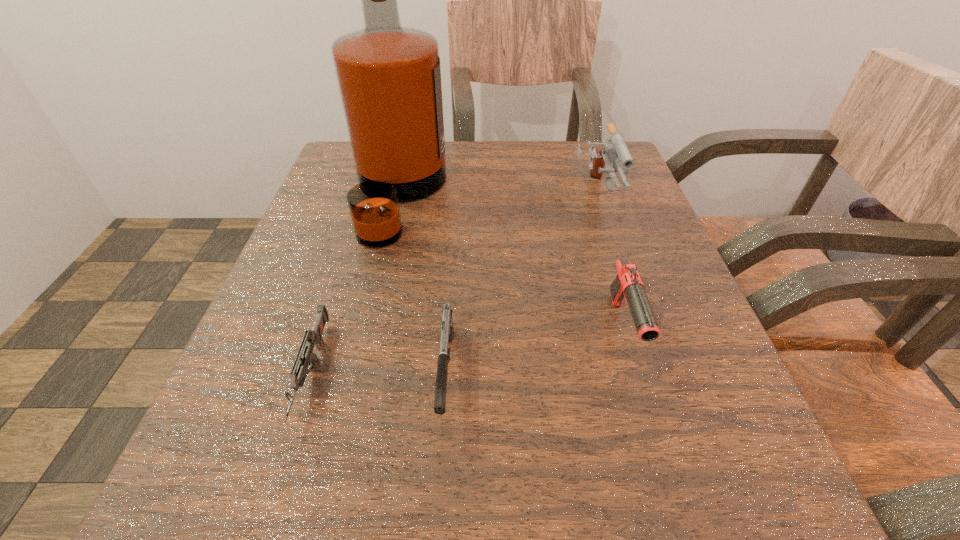
This screenshot has height=540, width=960. What are the coordinates of `empty space between the second shortest object and the leftmost gun` in the screenshot? It's located at (379, 373).

Identify the location of free space between the tallest object and the leftmost gun. (356, 285).

The image size is (960, 540). Find the location of `vacant area that lies between the farthest gun and the third gun from right to left`. vacant area that lies between the farthest gun and the third gun from right to left is located at coordinates (521, 285).

Where is `vacant area between the shortest gun and the second shortest gun`? vacant area between the shortest gun and the second shortest gun is located at coordinates (379, 373).

Find the location of a particular element. object that is the closest one to the fourth tallest object is located at coordinates (313, 337).

Identify the location of object that can be found as the closest to the liquor. (313, 337).

Choose which gun is the nearest neighbor to the third shortest object. Please provide its 2D coordinates. Your answer should be formatted as a tuple, i.e. [(x, y)], where the tuple contains the x and y coordinates of a point satisfying the conditions above.

[(614, 150)]

Identify the location of the third closest gun to the second tallest gun. The image size is (960, 540). pos(313,337).

Where is `free space that satisfies the following two spatial constraints: 1. on the front label of the liquor; 2. aimed along the barrel of the leftmost gun`? This screenshot has height=540, width=960. free space that satisfies the following two spatial constraints: 1. on the front label of the liquor; 2. aimed along the barrel of the leftmost gun is located at coordinates (358, 373).

Find the location of a particular element. blank area in the image that satisfies the following two spatial constraints: 1. at the barrel end of the tallest gun; 2. on the front label of the tallest object is located at coordinates (596, 197).